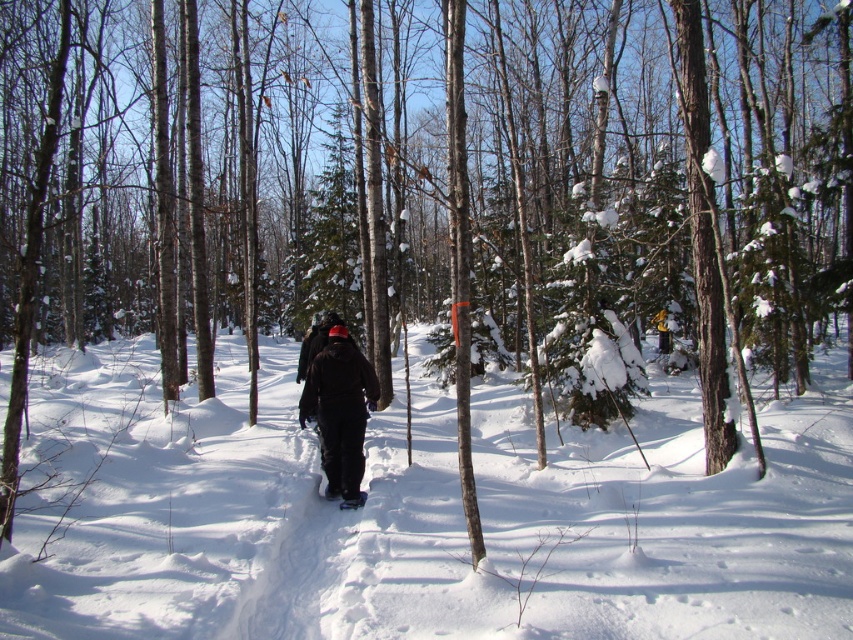
Between black fabric skier at center and white rubber snowshoe at center, which one has less height?

Standing shorter between the two is white rubber snowshoe at center.

The image size is (853, 640). Describe the element at coordinates (339, 406) in the screenshot. I see `black fabric skier at center` at that location.

The image size is (853, 640). Find the location of `black fabric skier at center`. black fabric skier at center is located at coordinates (339, 406).

Is the position of white fluffy snow at center more distant than that of black fabric skier at center?

No.

The image size is (853, 640). Find the location of `white fluffy snow at center`. white fluffy snow at center is located at coordinates (431, 518).

Between point (20, 529) and point (363, 497), which one is positioned in front?

Point (20, 529) is more forward.

Between white fluffy snow at center and white rubber snowshoe at center, which one appears on the right side from the viewer's perspective?

white fluffy snow at center is more to the right.

Locate an element on the screen. This screenshot has height=640, width=853. white fluffy snow at center is located at coordinates (431, 518).

At what (x,y) coordinates should I click in order to perform the action: click on white fluffy snow at center. Please return your answer as a coordinate pair (x, y). The height and width of the screenshot is (640, 853). Looking at the image, I should click on (431, 518).